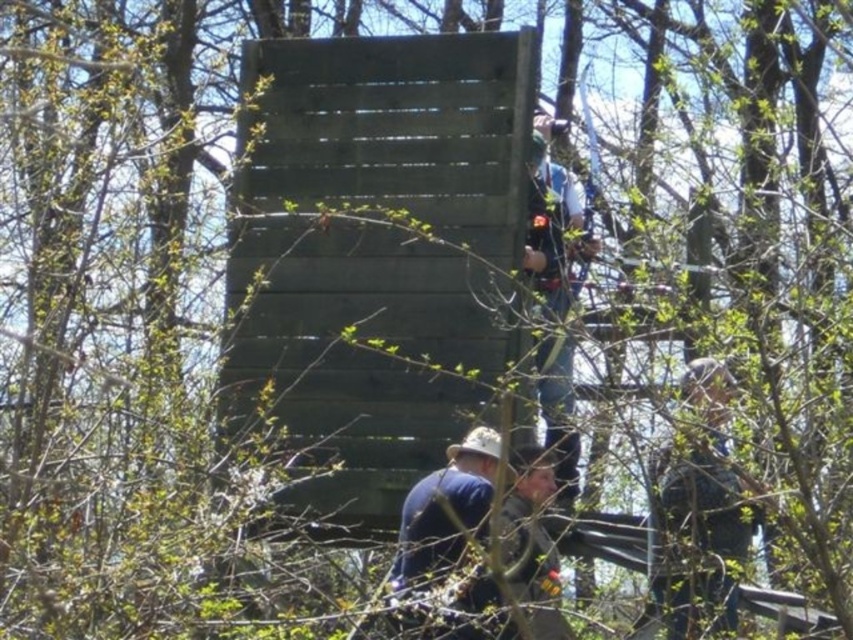
Is dark wood lift at center below camouflage fabric construction worker at right?

Correct, dark wood lift at center is located below camouflage fabric construction worker at right.

Is dark wood lift at center above camouflage fabric construction worker at right?

Incorrect, dark wood lift at center is not positioned above camouflage fabric construction worker at right.

Is point (285, 333) positioned behind point (669, 614)?

Yes, point (285, 333) is behind point (669, 614).

Locate an element on the screen. The height and width of the screenshot is (640, 853). dark wood lift at center is located at coordinates (375, 253).

Is dark wood lift at center below blue denim jeans at upper right?

Correct, dark wood lift at center is located below blue denim jeans at upper right.

Is dark wood lift at center taller than blue denim jeans at upper right?

Yes, dark wood lift at center is taller than blue denim jeans at upper right.

Which is in front, point (352, 520) or point (554, 266)?

Point (352, 520) is in front.

Locate an element on the screen. Image resolution: width=853 pixels, height=640 pixels. dark wood lift at center is located at coordinates click(x=375, y=253).

Is camouflage fabric construction worker at right to the left of blue denim jeans at upper right from the viewer's perspective?

In fact, camouflage fabric construction worker at right is to the right of blue denim jeans at upper right.

Who is taller, camouflage fabric construction worker at right or blue denim jeans at upper right?

With more height is camouflage fabric construction worker at right.

What do you see at coordinates (699, 504) in the screenshot? I see `camouflage fabric construction worker at right` at bounding box center [699, 504].

At what (x,y) coordinates should I click in order to perform the action: click on camouflage fabric construction worker at right. Please return your answer as a coordinate pair (x, y). Looking at the image, I should click on (699, 504).